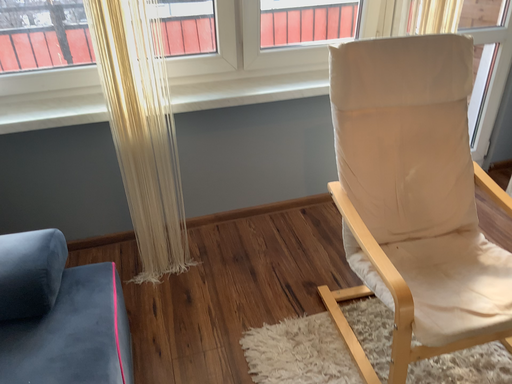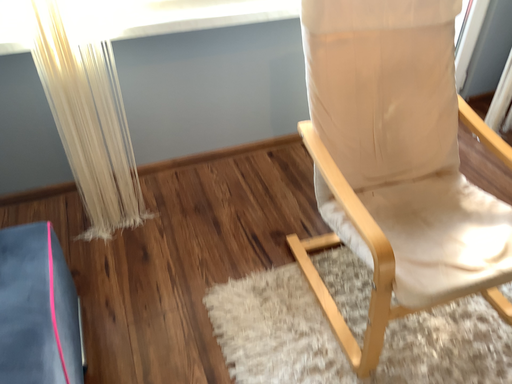
Question: How did the camera likely rotate when shooting the video?

Choices:
 (A) rotated downward
 (B) rotated upward

Answer: (A)